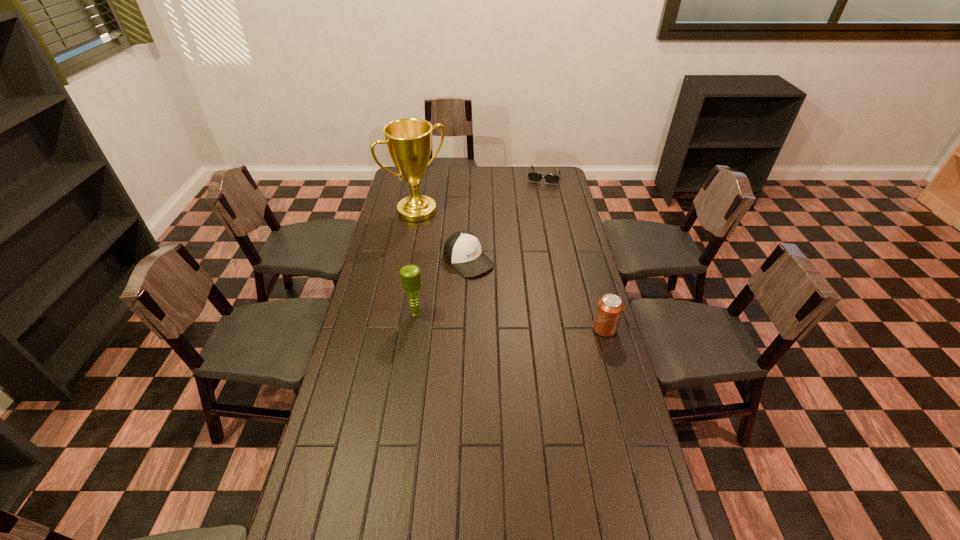
You are a GUI agent. You are given a task and a screenshot of the screen. Output one action in this format:
    pyautogui.click(x=<x>, y=<y>)
    Task: Click on the object that is positioned at the left edge
    Image resolution: width=960 pixels, height=540 pixels.
    Given the screenshot: What is the action you would take?
    click(x=409, y=140)

The image size is (960, 540). In order to click on can that is positioned at the right edge in this screenshot , I will do `click(609, 309)`.

At what (x,y) coordinates should I click in order to perform the action: click on sunglasses that is positioned at the right edge. Please return your answer as a coordinate pair (x, y). Image resolution: width=960 pixels, height=540 pixels. Looking at the image, I should click on (532, 176).

This screenshot has width=960, height=540. I want to click on object that is at the far right corner, so click(x=532, y=176).

Image resolution: width=960 pixels, height=540 pixels. Identify the location of vacant region at the far edge of the desktop. (467, 173).

The image size is (960, 540). Find the location of `free space at the near edge of the desktop`. free space at the near edge of the desktop is located at coordinates (530, 528).

Where is `vacant space at the left edge of the desktop`? This screenshot has height=540, width=960. vacant space at the left edge of the desktop is located at coordinates (374, 291).

This screenshot has width=960, height=540. I want to click on vacant region at the right edge, so click(x=564, y=235).

Locate an element on the screen. The width and height of the screenshot is (960, 540). vacant area between the third farthest object and the microphone is located at coordinates (443, 287).

You are a GUI agent. You are given a task and a screenshot of the screen. Output one action in this format:
    pyautogui.click(x=<x>, y=<y>)
    Task: Click on the vacant region between the award and the second shortest object
    The width and height of the screenshot is (960, 540).
    Given the screenshot: What is the action you would take?
    pyautogui.click(x=443, y=236)